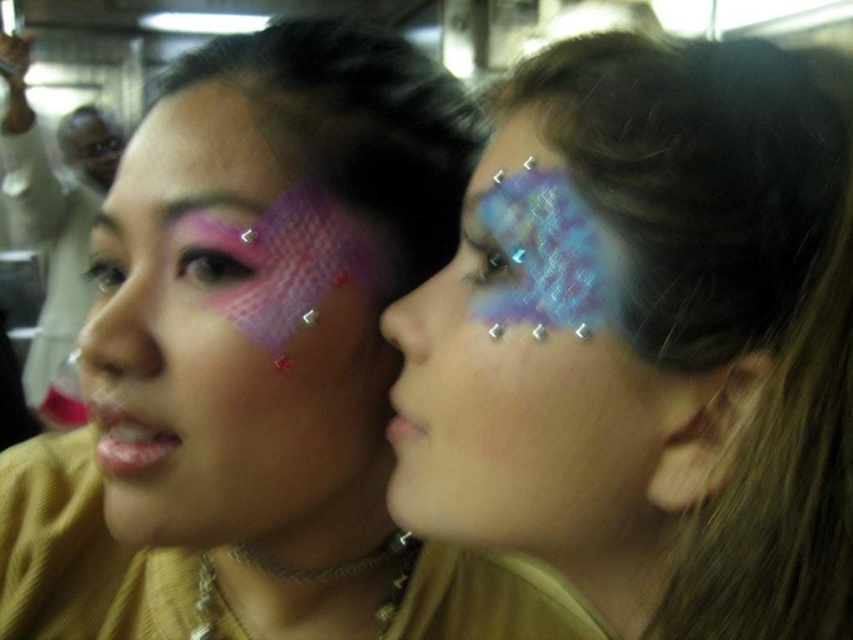
You are an artist observing the two people in the image. You notice the matte pink mesh at upper left and the matte pink mesh nose at center. Which of these two objects is positioned closer to the left side of the image?

The matte pink mesh at upper left is positioned closer to the left side of the image than the matte pink mesh nose at center.

You are an artist observing the two individuals in the image. You notice the matte pink mesh at upper left and the matte pink mesh nose at center. Which of these two objects is taller?

The matte pink mesh at upper left is much taller than the matte pink mesh nose at center.

You are a makeup artist standing in front of the shiny blue face paint at right. You need to apply a new design that requires reaching exactly 30 centimeters away from your face. Can you do this without moving your position?

The shiny blue face paint at right is 29.87 centimeters away from the viewer, which is just under the required 30 centimeters. Therefore, you cannot reach exactly 30 centimeters without moving closer.